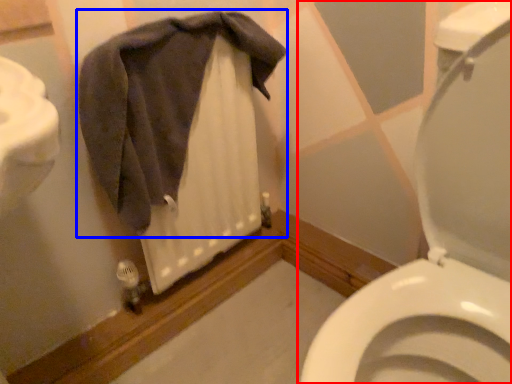
Question: Which of the following is the closest to the observer, toilet (highlighted by a red box) or bath towel (highlighted by a blue box)?

Choices:
 (A) toilet
 (B) bath towel

Answer: (A)